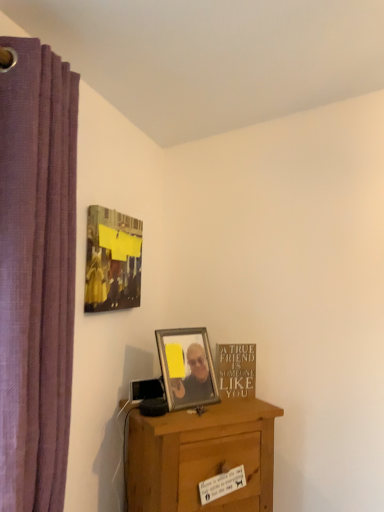
Locate an element on the screen. The image size is (384, 512). free spot in front of metallic silver picture frame at center, which appears as the first picture frame when viewed from the right is located at coordinates (190, 415).